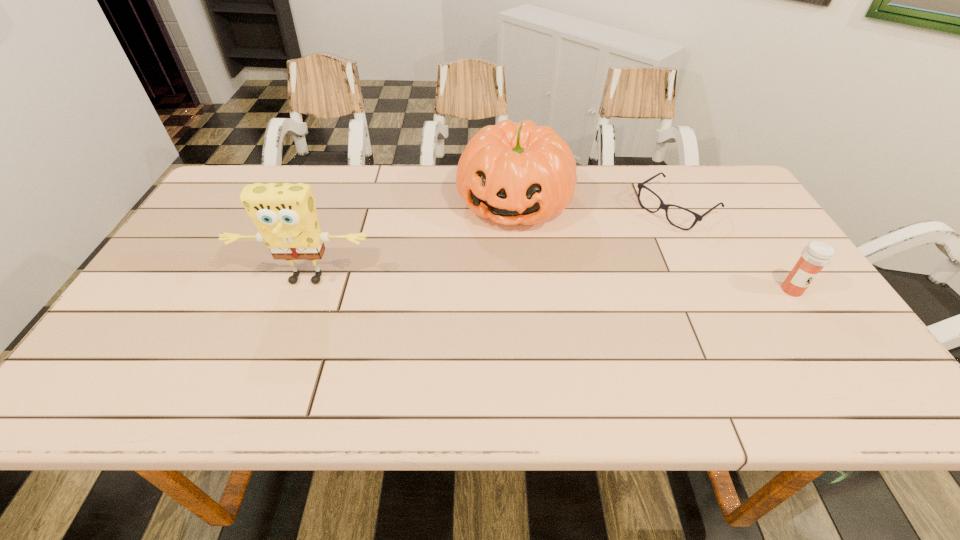
Find the location of a particular element. free space on the desktop that is between the sponge and the medicine and is positioned on the front-facing side of the shortest object is located at coordinates (562, 285).

Find the location of `free space on the desktop that is between the leftmost object and the second shortest object and is positioned on the carved face of the third object from right to left`. free space on the desktop that is between the leftmost object and the second shortest object and is positioned on the carved face of the third object from right to left is located at coordinates (483, 284).